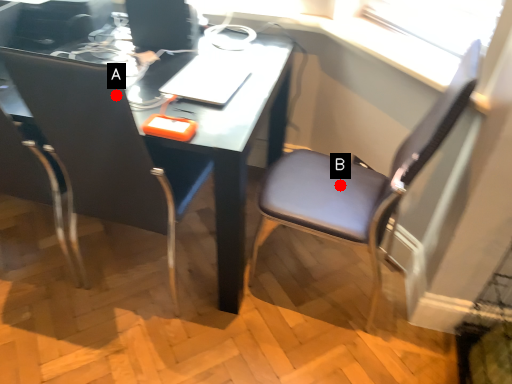
Question: Two points are circled on the image, labeled by A and B beside each circle. Among these points, which one is nearest to the camera?

Choices:
 (A) A is closer
 (B) B is closer

Answer: (A)